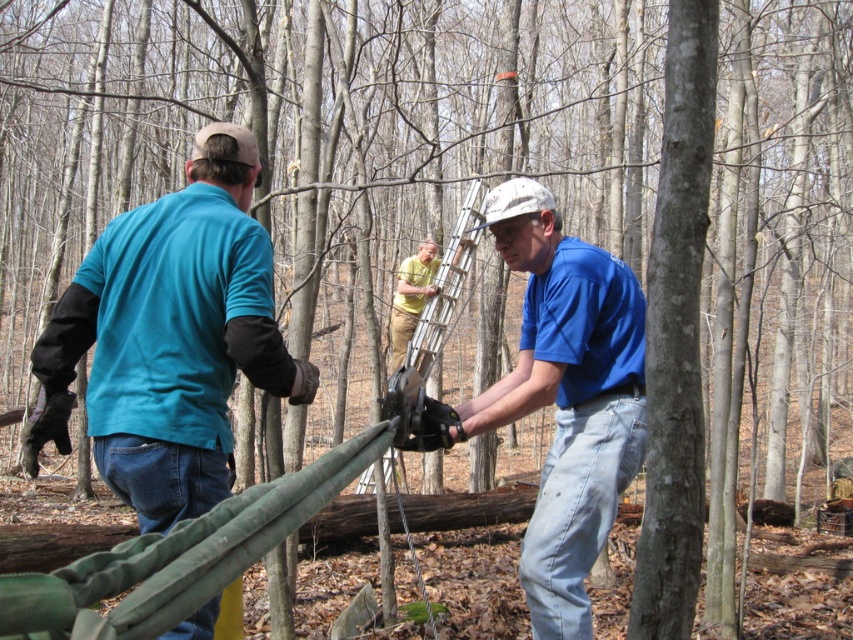
You are a safety inspector observing the logging operation in the wooded area. You notice the teal fabric shirt at left and the blue fabric at center. Which fabric is located to the left of the other?

The teal fabric shirt at left is positioned on the left side of blue fabric at center, so the teal fabric shirt at left is to the left of the blue fabric at center.

You are a safety inspector checking the equipment at the logging site. You notice the blue fabric at center and the white fabric cap at center. Which one has a greater width?

The blue fabric at center has a greater width than the white fabric cap at center.

You are standing at the origin point in the wooded area. There are two points marked in the scene. The first point is at coordinates point (96,458) and the second is at point (480,225). Which of these two points is closer to you?

Point (96,458) is in front of point (480,225), so it is closer to you.